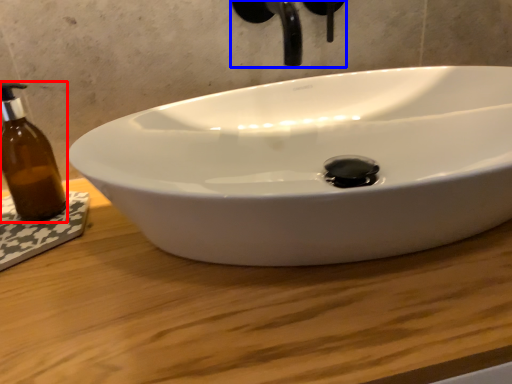
Question: Among these objects, which one is farthest to the camera, bottle (highlighted by a red box) or plumbing fixture (highlighted by a blue box)?

Choices:
 (A) bottle
 (B) plumbing fixture

Answer: (A)